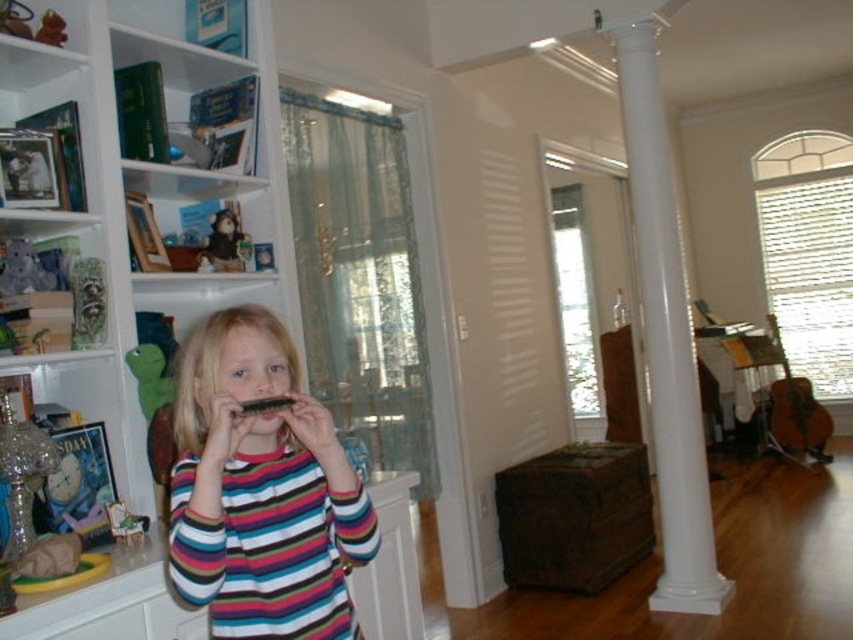
Who is shorter, striped fabric child at center or white smooth column at center?

striped fabric child at center is shorter.

Does striped fabric child at center appear under white smooth column at center?

Correct, striped fabric child at center is located below white smooth column at center.

Which is in front, point (219, 541) or point (641, 92)?

Positioned in front is point (219, 541).

Image resolution: width=853 pixels, height=640 pixels. Find the location of `striped fabric child at center`. striped fabric child at center is located at coordinates (260, 490).

Between point (253, 36) and point (723, 579), which one is positioned in front?

Positioned in front is point (253, 36).

Who is positioned more to the right, white wood bookcase at left or white smooth column at center?

From the viewer's perspective, white smooth column at center appears more on the right side.

Image resolution: width=853 pixels, height=640 pixels. I want to click on white wood bookcase at left, so click(146, 193).

Is point (260, 88) farther from viewer compared to point (229, 234)?

That is True.

Who is more forward, (122, 444) or (215, 243)?

Point (122, 444) is in front.

Is point (120, 305) farther from camera compared to point (231, 220)?

No, it is in front of (231, 220).

Where is `white wood bookcase at left`? The image size is (853, 640). white wood bookcase at left is located at coordinates (146, 193).